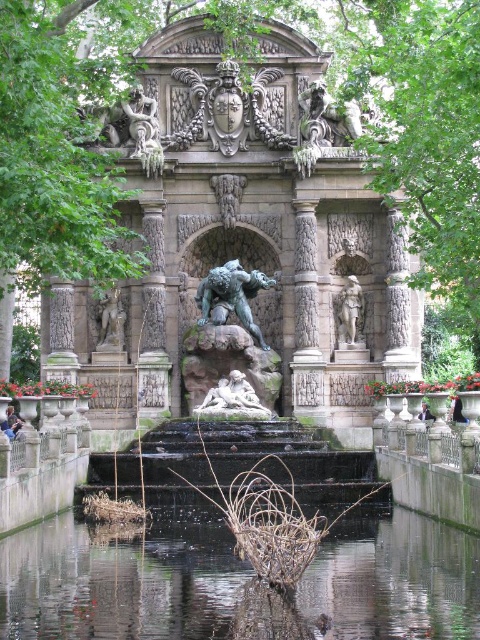
Does carved stone fountain at center have a larger size compared to bronze statue at left?

Yes.

Based on the photo, between carved stone fountain at center and bronze statue at left, which one appears on the right side from the viewer's perspective?

From the viewer's perspective, carved stone fountain at center appears more on the right side.

Where is `carved stone fountain at center`? This screenshot has width=480, height=640. carved stone fountain at center is located at coordinates (241, 236).

Who is positioned more to the left, carved stone fountain at center or green stone statue at center?

From the viewer's perspective, carved stone fountain at center appears more on the left side.

This screenshot has width=480, height=640. I want to click on carved stone fountain at center, so click(x=241, y=236).

Is point (360, 173) positioned in front of point (240, 298)?

No, it is not.

Find the location of a particular element. carved stone fountain at center is located at coordinates (241, 236).

Does point (278, 257) come in front of point (249, 401)?

No, it is not.

Who is shorter, carved stone fountain at center or white marble reclining figure at center?

Standing shorter between the two is white marble reclining figure at center.

Image resolution: width=480 pixels, height=640 pixels. In order to click on carved stone fountain at center in this screenshot , I will do `click(241, 236)`.

This screenshot has width=480, height=640. I want to click on carved stone fountain at center, so click(x=241, y=236).